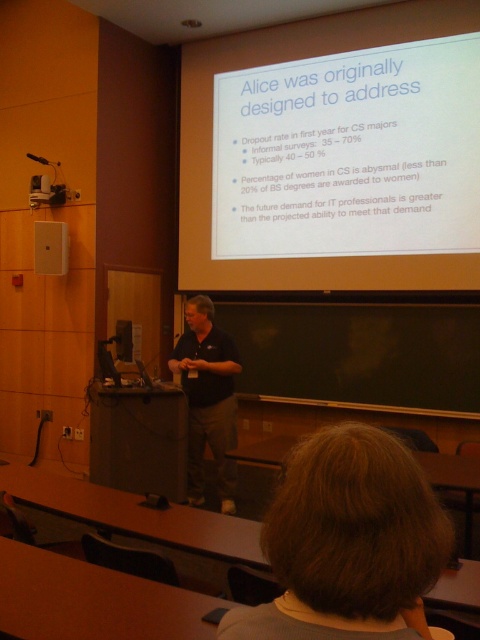
Which is more to the left, white matte projector screen at upper center or dark blue shirt at center?

Positioned to the left is dark blue shirt at center.

Is white matte projector screen at upper center bigger than dark blue shirt at center?

Yes, white matte projector screen at upper center is bigger than dark blue shirt at center.

The height and width of the screenshot is (640, 480). Describe the element at coordinates (349, 154) in the screenshot. I see `white matte projector screen at upper center` at that location.

This screenshot has height=640, width=480. What are the coordinates of `white matte projector screen at upper center` in the screenshot? It's located at (349, 154).

Which of these two, white matte projector screen at upper center or brown hair at upper center, stands shorter?

brown hair at upper center

Can you confirm if white matte projector screen at upper center is positioned above brown hair at upper center?

Correct, white matte projector screen at upper center is located above brown hair at upper center.

Is point (363, 195) closer to viewer compared to point (299, 506)?

No.

This screenshot has width=480, height=640. In order to click on white matte projector screen at upper center in this screenshot , I will do `click(349, 154)`.

Is brown hair at upper center below dark blue shirt at center?

Actually, brown hair at upper center is above dark blue shirt at center.

Which of these two, brown hair at upper center or dark blue shirt at center, stands shorter?

Standing shorter between the two is brown hair at upper center.

In the scene shown: Who is more distant from viewer, (276,616) or (213,368)?

Positioned behind is point (213,368).

You are a GUI agent. You are given a task and a screenshot of the screen. Output one action in this format:
    pyautogui.click(x=<x>, y=<y>)
    Task: Click on the brown hair at upper center
    
    Given the screenshot: What is the action you would take?
    pyautogui.click(x=348, y=541)